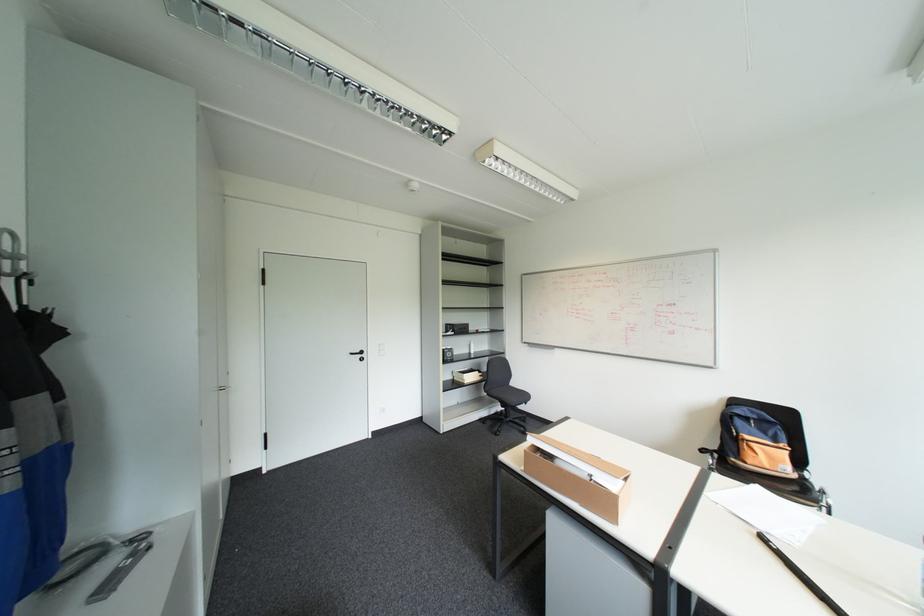
Locate an element on the screen. The width and height of the screenshot is (924, 616). backpack handle is located at coordinates (783, 427).